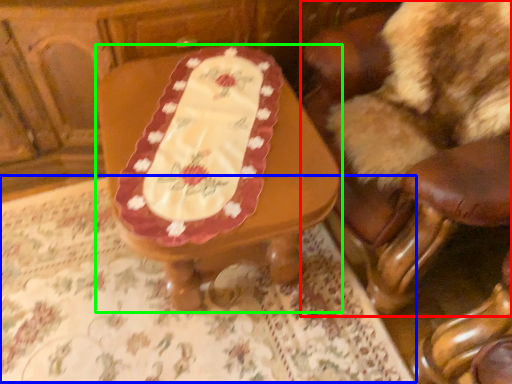
Question: Estimate the real-world distances between objects in this image. Which object is closer to chair (highlighted by a red box), tablecloth (highlighted by a blue box) or table (highlighted by a green box)?

Choices:
 (A) tablecloth
 (B) table

Answer: (B)